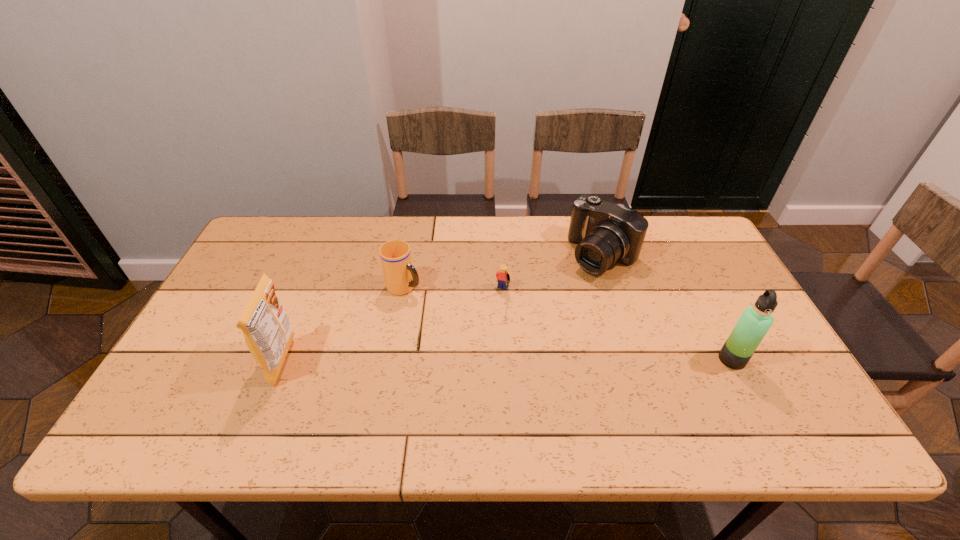
Where is `vacant space on the desktop that is between the crisp (potato chip) and the rightmost object and is positioned on the front-facing side of the Lego`? vacant space on the desktop that is between the crisp (potato chip) and the rightmost object and is positioned on the front-facing side of the Lego is located at coordinates (470, 361).

The width and height of the screenshot is (960, 540). In order to click on vacant spot on the desktop that is between the crisp (potato chip) and the rightmost object and is positioned on the lens of the camera in this screenshot , I will do `click(485, 361)`.

This screenshot has width=960, height=540. What are the coordinates of `free spot on the desktop that is between the leftmost object and the rightmost object and is positioned on the side of the second object from left to right with the handle` in the screenshot? It's located at (540, 360).